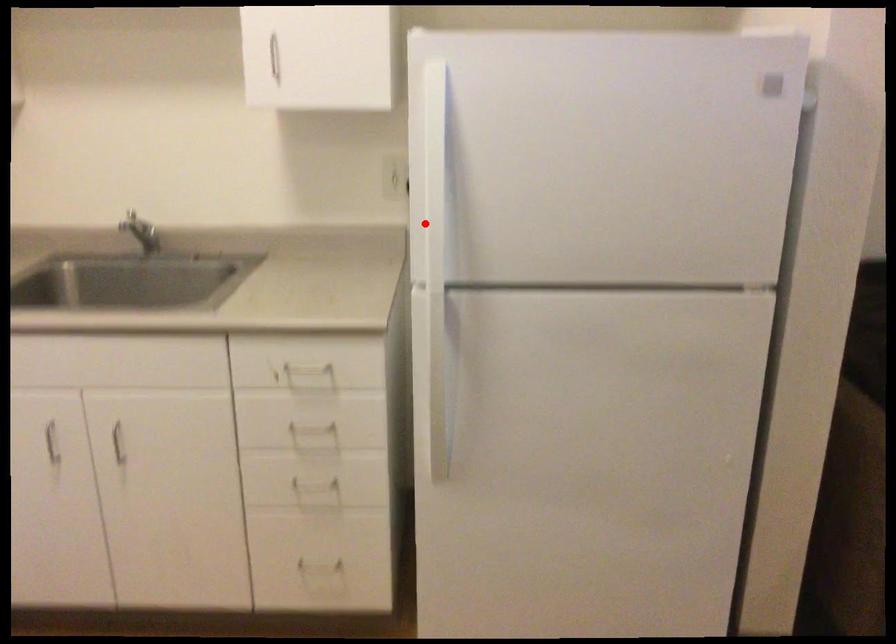
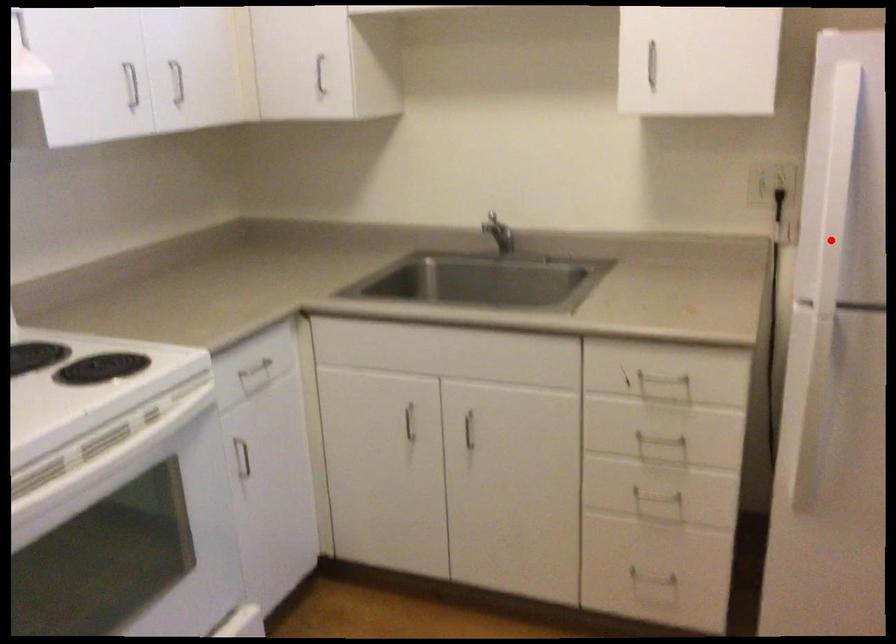
I am providing you with two images of the same scene from different viewpoints. A red point is marked on the first image and another point is marked on the second image. Are the points marked in image1 and image2 representing the same 3D position?

Yes